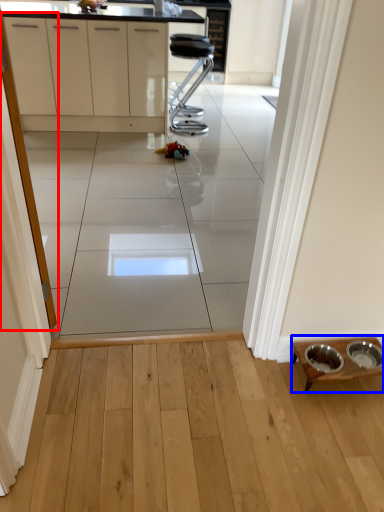
Question: Which point is further to the camera, screen door (highlighted by a red box) or table (highlighted by a blue box)?

Choices:
 (A) screen door
 (B) table

Answer: (B)